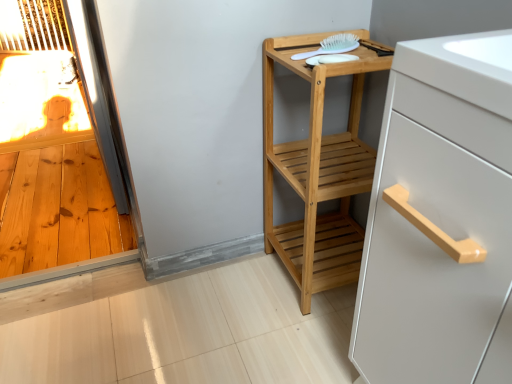
Question: Can you confirm if white plastic brush at upper right is bigger than natural wood shelf at center?

Choices:
 (A) no
 (B) yes

Answer: (A)

Question: Is white plastic brush at upper right far from natural wood shelf at center?

Choices:
 (A) no
 (B) yes

Answer: (A)

Question: Is white plastic brush at upper right oriented towards natural wood shelf at center?

Choices:
 (A) yes
 (B) no

Answer: (A)

Question: From a real-world perspective, is white plastic brush at upper right physically above natural wood shelf at center?

Choices:
 (A) yes
 (B) no

Answer: (A)

Question: From a real-world perspective, is white plastic brush at upper right located beneath natural wood shelf at center?

Choices:
 (A) no
 (B) yes

Answer: (A)

Question: In terms of width, does white plastic brush at upper right look wider or thinner when compared to natural wood shelf at center?

Choices:
 (A) wide
 (B) thin

Answer: (B)

Question: Is point (309, 51) closer or farther from the camera than point (337, 241)?

Choices:
 (A) closer
 (B) farther

Answer: (A)

Question: In terms of height, does white plastic brush at upper right look taller or shorter compared to natural wood shelf at center?

Choices:
 (A) tall
 (B) short

Answer: (B)

Question: From a real-world perspective, relative to natural wood shelf at center, is white plastic brush at upper right vertically above or below?

Choices:
 (A) above
 (B) below

Answer: (A)

Question: Is point (421, 210) positioned closer to the camera than point (265, 190)?

Choices:
 (A) farther
 (B) closer

Answer: (B)

Question: Considering the positions of white matte cabinet handle at upper right and natural wood shelf at center in the image, is white matte cabinet handle at upper right bigger or smaller than natural wood shelf at center?

Choices:
 (A) big
 (B) small

Answer: (A)

Question: From the image's perspective, relative to natural wood shelf at center, is white matte cabinet handle at upper right above or below?

Choices:
 (A) above
 (B) below

Answer: (B)

Question: From a real-world perspective, is white matte cabinet handle at upper right above or below natural wood shelf at center?

Choices:
 (A) above
 (B) below

Answer: (A)

Question: Relative to white matte cabinet handle at upper right, is white plastic brush at upper right in front or behind?

Choices:
 (A) behind
 (B) front

Answer: (A)

Question: In the image, is white plastic brush at upper right on the left side or the right side of white matte cabinet handle at upper right?

Choices:
 (A) left
 (B) right

Answer: (A)